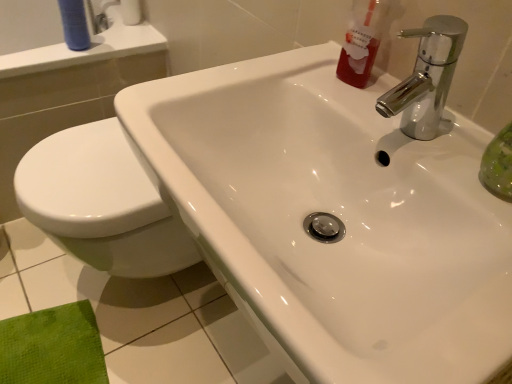
At what (x,y) coordinates should I click in order to perform the action: click on vacant space behind blue matte tube at upper left. Please return your answer as a coordinate pair (x, y). This screenshot has width=512, height=384. Looking at the image, I should click on (115, 32).